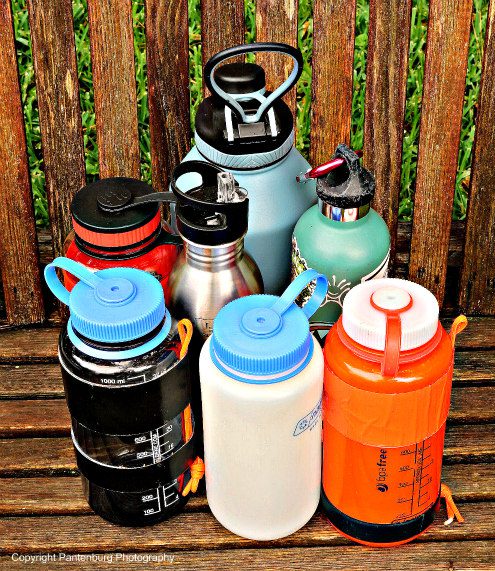
Where is `bottle`? This screenshot has height=571, width=495. bottle is located at coordinates (263, 167), (110, 248), (207, 270), (393, 233), (135, 397), (261, 416), (385, 411).